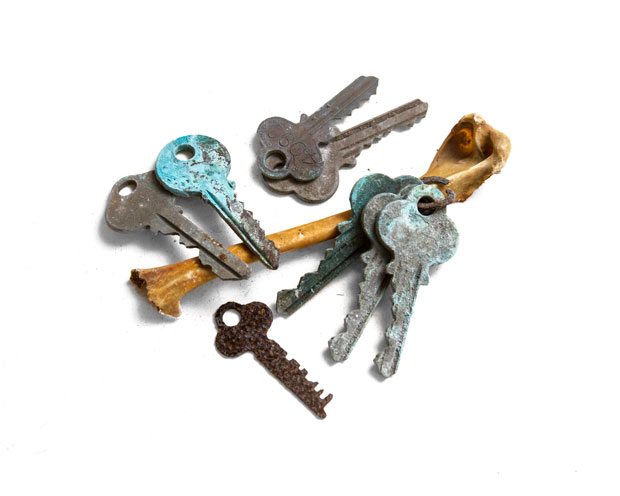
In order to click on keys in this screenshot , I will do `click(415, 245)`, `click(383, 256)`, `click(360, 248)`, `click(326, 181)`, `click(299, 162)`, `click(214, 169)`, `click(144, 211)`, `click(257, 343)`.